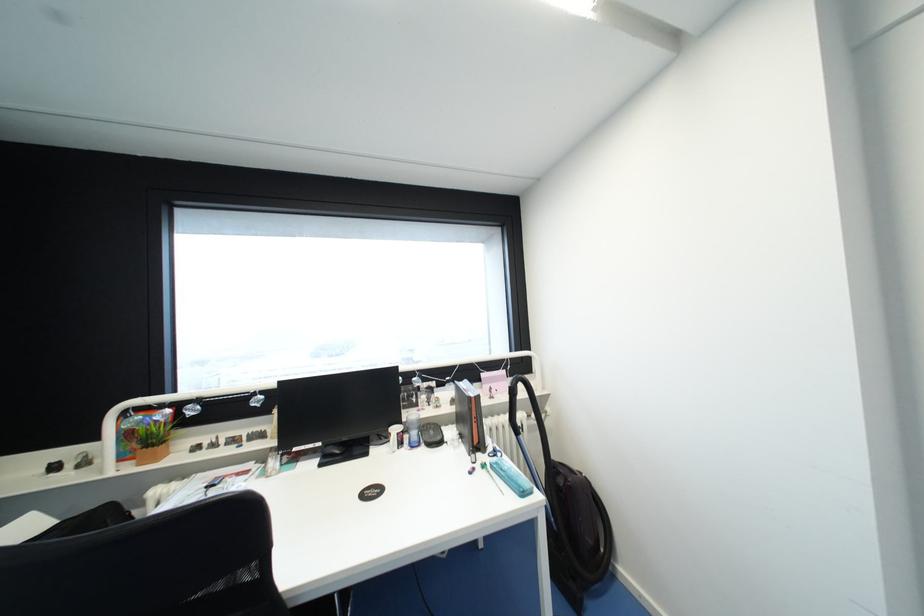
The location [412,429] corresponds to which object?

It corresponds to the white cup in the image.